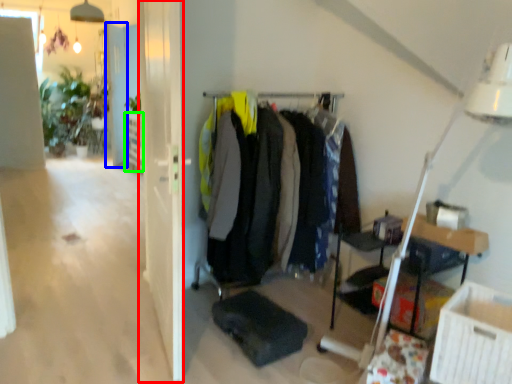
Question: Considering the real-world distances, which object is farthest from glass door (highlighted by a red box)? door (highlighted by a blue box) or shelf (highlighted by a green box)?

Choices:
 (A) door
 (B) shelf

Answer: (A)